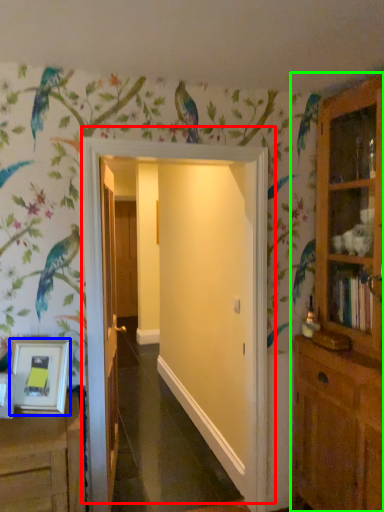
Question: Considering the real-world distances, which object is farthest from door (highlighted by a red box)? picture frame (highlighted by a blue box) or cupboard (highlighted by a green box)?

Choices:
 (A) picture frame
 (B) cupboard

Answer: (B)